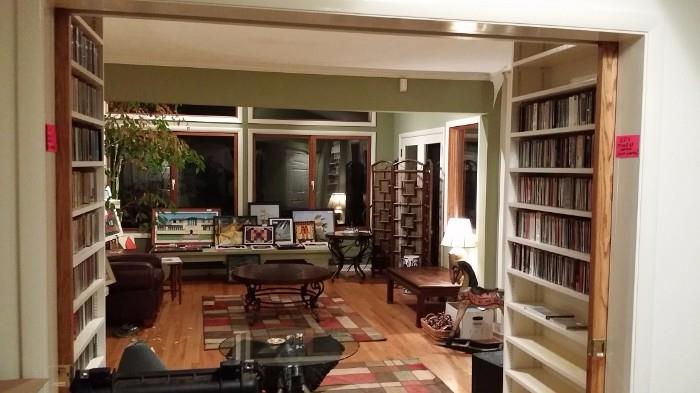
Find the location of a particular element. The width and height of the screenshot is (700, 393). white shelf is located at coordinates (533, 170).